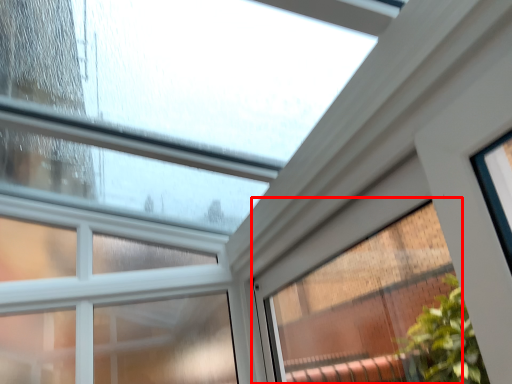
Question: From the image's perspective, what is the correct spatial positioning of window (annotated by the red box) in reference to window?

Choices:
 (A) above
 (B) below

Answer: (A)